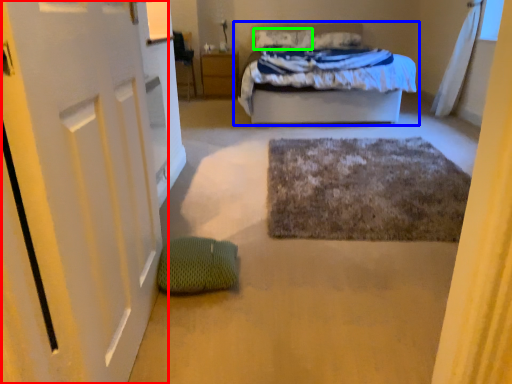
Question: Considering the real-world distances, which object is closest to door (highlighted by a red box)? bed (highlighted by a blue box) or pillow (highlighted by a green box).

Choices:
 (A) bed
 (B) pillow

Answer: (A)